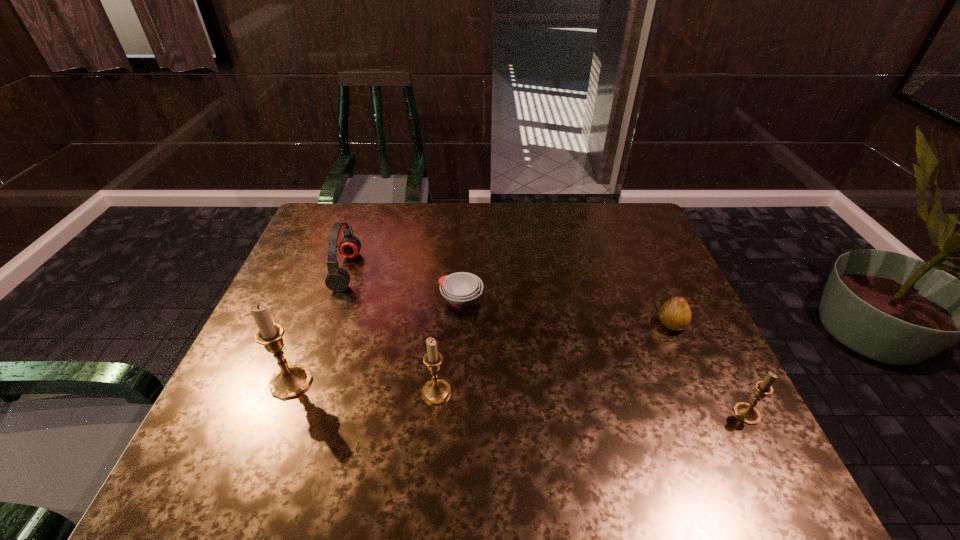
Image resolution: width=960 pixels, height=540 pixels. Identify the location of free space between the second object from right to left and the second shortest candle holder. (554, 358).

You are a GUI agent. You are given a task and a screenshot of the screen. Output one action in this format:
    pyautogui.click(x=<x>, y=<y>)
    Task: Click on the free space between the leftmost candle holder and the second shortest candle holder
    
    Given the screenshot: What is the action you would take?
    pyautogui.click(x=364, y=387)

Where is `vacant area between the rightmost candle holder and the shortest object`? vacant area between the rightmost candle holder and the shortest object is located at coordinates (604, 357).

You are a GUI agent. You are given a task and a screenshot of the screen. Output one action in this format:
    pyautogui.click(x=<x>, y=<y>)
    Task: Click on the empty space between the rightmost object and the pear
    
    Given the screenshot: What is the action you would take?
    coord(709,369)

Where is `free space between the pear and the tallest candle holder`? This screenshot has width=960, height=540. free space between the pear and the tallest candle holder is located at coordinates (481, 353).

In order to click on free space between the shortest candle holder and the tallest object in this screenshot , I will do `click(518, 398)`.

Find the location of a particular element. Image resolution: width=960 pixels, height=540 pixels. empty space that is in between the earphone and the shortest candle holder is located at coordinates (546, 342).

You are a GUI agent. You are given a task and a screenshot of the screen. Output one action in this format:
    pyautogui.click(x=<x>, y=<y>)
    Task: Click on the object that stands as the fifth closest to the second candle holder from left to right
    This screenshot has height=540, width=960.
    Given the screenshot: What is the action you would take?
    pyautogui.click(x=747, y=413)

Choose which object is the fifth nearest neighbor to the second candle holder from right to left. Please provide its 2D coordinates. Your answer should be formatted as a tuple, i.e. [(x, y)], where the tuple contains the x and y coordinates of a point satisfying the conditions above.

[(747, 413)]

Identify which candle holder is the closest to the shortest candle holder. Please provide its 2D coordinates. Your answer should be formatted as a tuple, i.e. [(x, y)], where the tuple contains the x and y coordinates of a point satisfying the conditions above.

[(436, 391)]